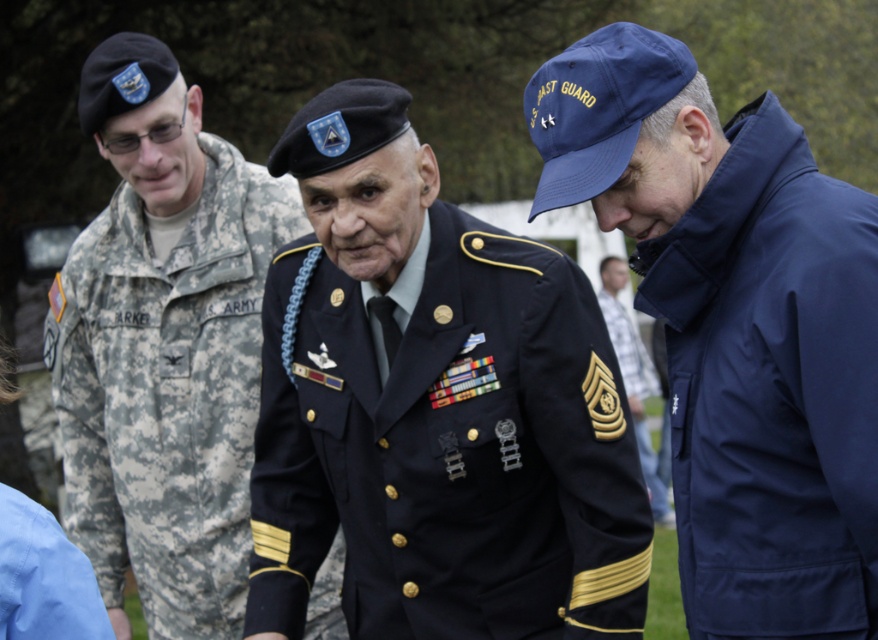
Question: Considering the relative positions of camouflage uniform at left and blue fabric shirt at lower left in the image provided, where is camouflage uniform at left located with respect to blue fabric shirt at lower left?

Choices:
 (A) left
 (B) right

Answer: (A)

Question: Where is navy blue fabric uniform at center located in relation to blue fabric shirt at lower left in the image?

Choices:
 (A) left
 (B) right

Answer: (B)

Question: Can you confirm if navy blue fabric uniform at center is positioned below blue fabric shirt at lower left?

Choices:
 (A) yes
 (B) no

Answer: (B)

Question: Among these objects, which one is nearest to the camera?

Choices:
 (A) navy blue uniform at center
 (B) navy blue fabric uniform at center
 (C) navy blue jacket at lower right

Answer: (C)

Question: Which of the following is the closest to the observer?

Choices:
 (A) (756, 305)
 (B) (11, 504)

Answer: (A)

Question: Among these points, which one is farthest from the camera?

Choices:
 (A) (614, 260)
 (B) (754, 458)
 (C) (88, 621)
 (D) (146, 92)

Answer: (A)